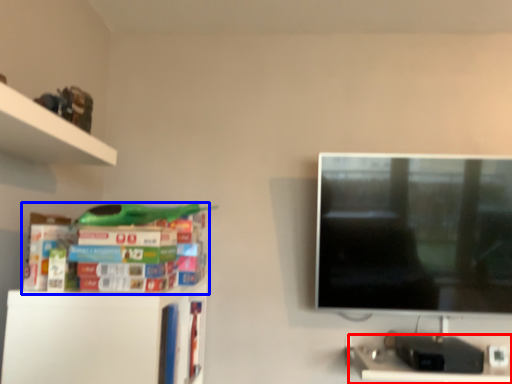
Question: Which object appears closest to the camera in this image, computer desk (highlighted by a red box) or book (highlighted by a blue box)?

Choices:
 (A) computer desk
 (B) book

Answer: (B)